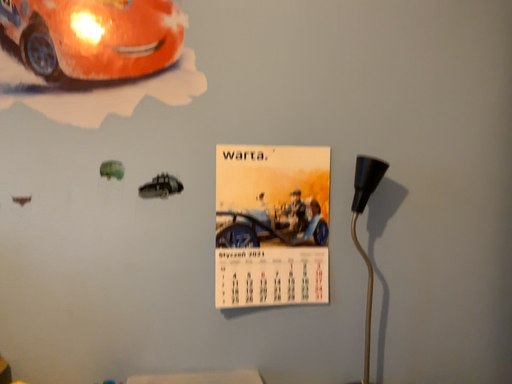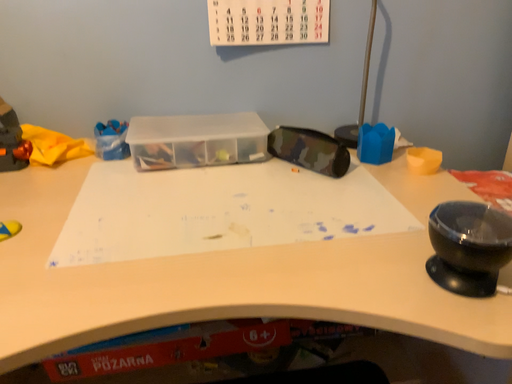
Question: Which way did the camera rotate in the video?

Choices:
 (A) rotated downward
 (B) rotated upward

Answer: (A)